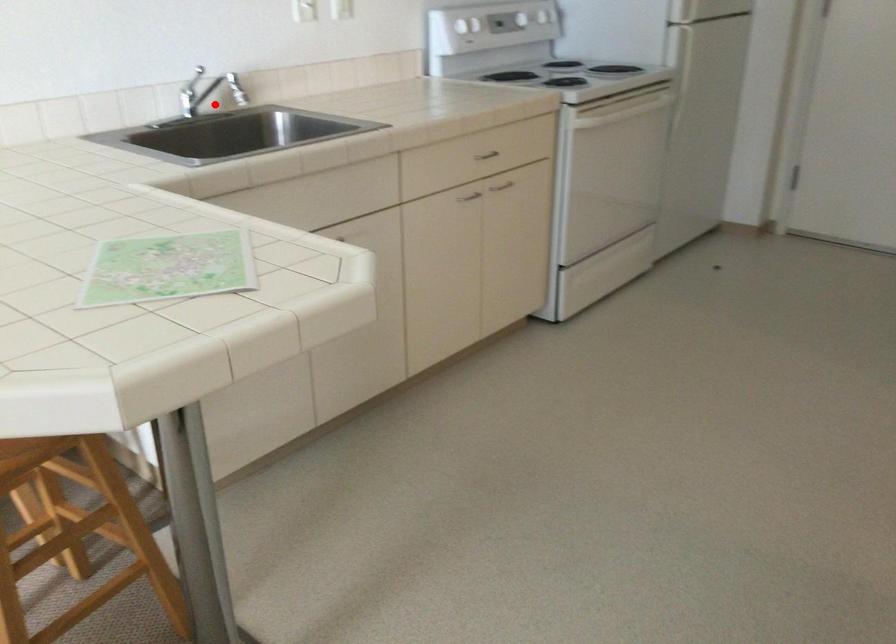
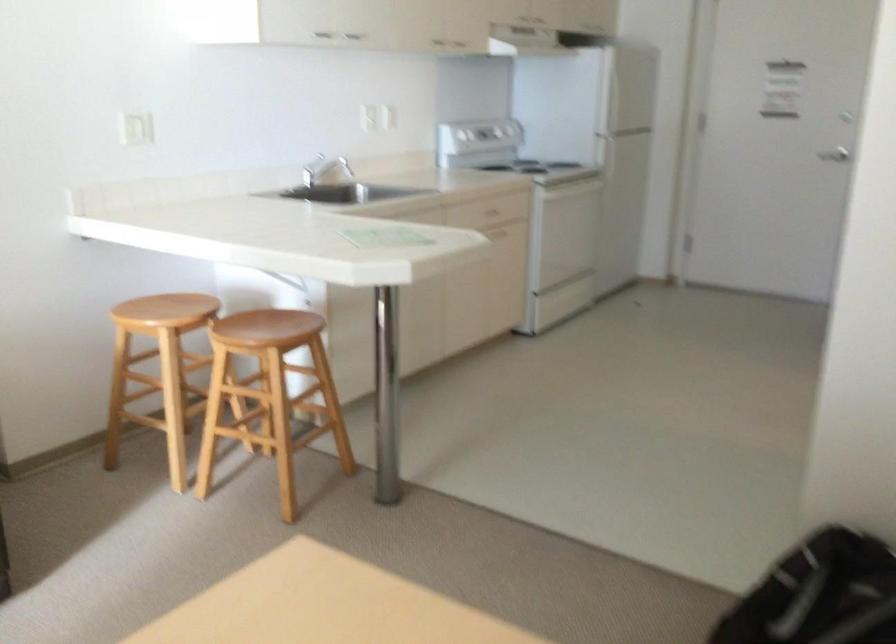
The point at the highlighted location is marked in the first image. Where is the corresponding point in the second image?

(317, 171)